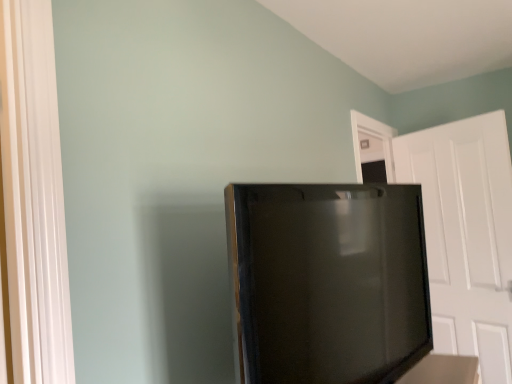
Question: From the image's perspective, is white matte door at right above or below black glossy refrigerator at center?

Choices:
 (A) below
 (B) above

Answer: (A)

Question: From a real-world perspective, relative to black glossy refrigerator at center, is white matte door at right vertically above or below?

Choices:
 (A) below
 (B) above

Answer: (A)

Question: Looking at their shapes, would you say white matte door at right is wider or thinner than black glossy refrigerator at center?

Choices:
 (A) thin
 (B) wide

Answer: (A)

Question: From a real-world perspective, is black glossy refrigerator at center physically located above or below white matte door at right?

Choices:
 (A) above
 (B) below

Answer: (A)

Question: Visually, is black glossy refrigerator at center positioned to the left or to the right of white matte door at right?

Choices:
 (A) left
 (B) right

Answer: (A)

Question: Is point (379, 365) closer or farther from the camera than point (441, 253)?

Choices:
 (A) farther
 (B) closer

Answer: (B)

Question: Considering the positions of black glossy refrigerator at center and white matte door at right in the image, is black glossy refrigerator at center bigger or smaller than white matte door at right?

Choices:
 (A) small
 (B) big

Answer: (B)